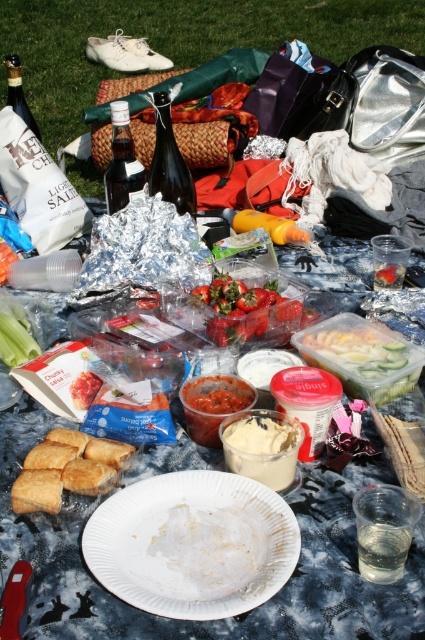
You are planning to pack up the picnic and need to know which item takes up more space between the golden brown pastry at center and the translucent plastic container at center. Which one should you consider first?

The golden brown pastry at center is larger in size than the translucent plastic container at center, so you should consider packing the golden brown pastry at center first as it requires more space.

You are organizing a picnic and have both the white creamy spread at center and the smooth red tomato at center on your picnic blanket. Which item takes up more space on the blanket?

The white creamy spread at center is larger in size than the smooth red tomato at center, so it takes up more space on the blanket.